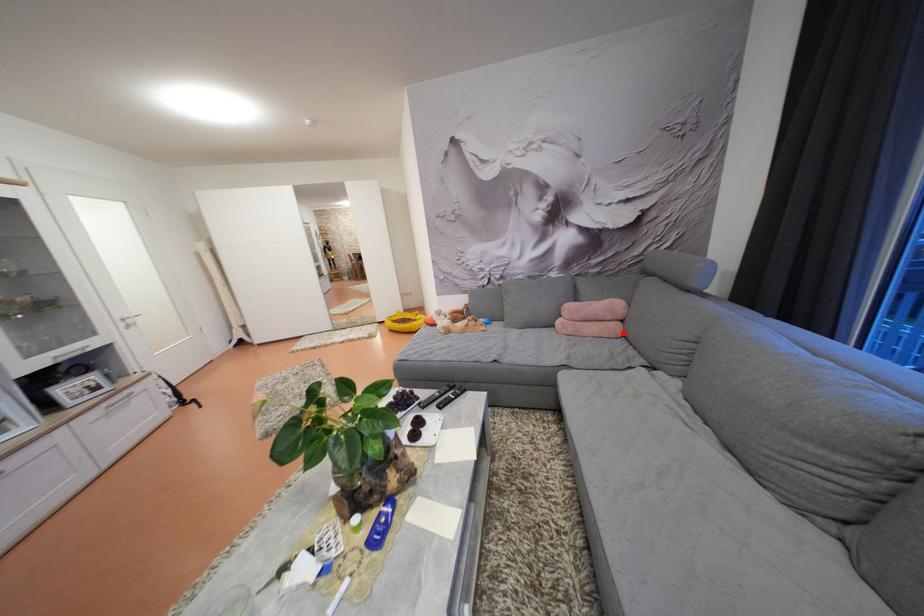
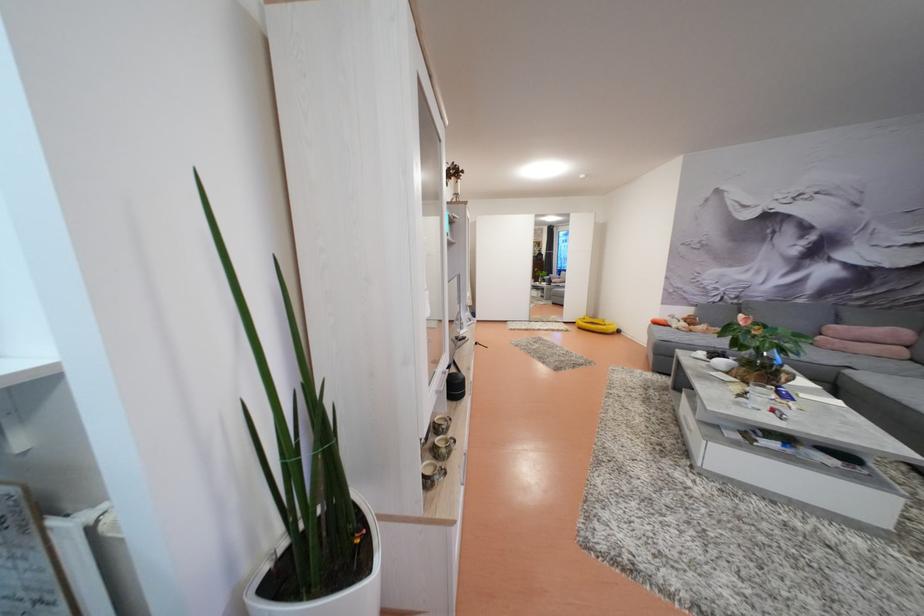
Locate, in the second image, the point that corresponds to the highlighted location in the first image.

(908, 355)